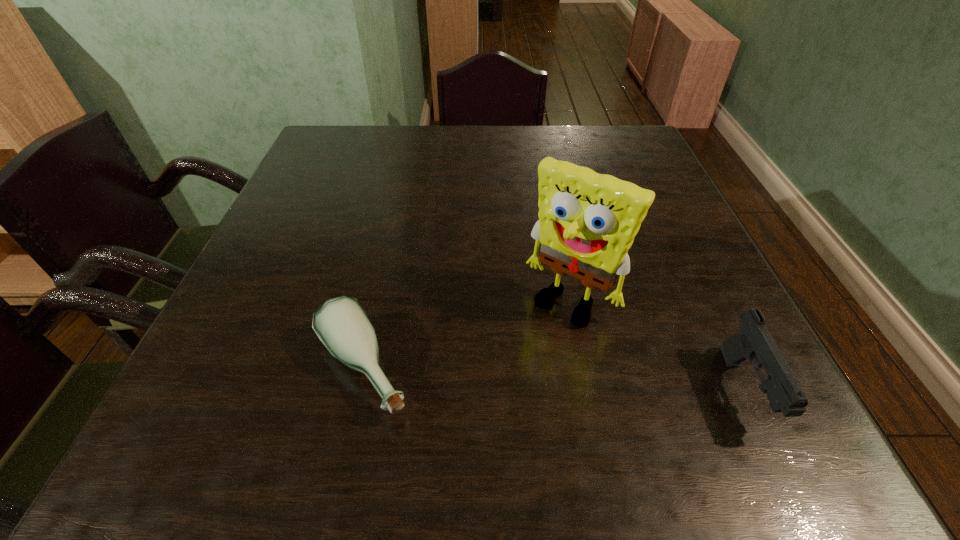
You are a GUI agent. You are given a task and a screenshot of the screen. Output one action in this format:
    pyautogui.click(x=<x>, y=<y>)
    Task: Click on the shortest object
    The width and height of the screenshot is (960, 540).
    Given the screenshot: What is the action you would take?
    pyautogui.click(x=342, y=325)

You are a GUI agent. You are given a task and a screenshot of the screen. Output one action in this format:
    pyautogui.click(x=<x>, y=<y>)
    Task: Click on the leftmost object
    
    Given the screenshot: What is the action you would take?
    pyautogui.click(x=342, y=325)

Image resolution: width=960 pixels, height=540 pixels. What are the coordinates of `the second shortest object` in the screenshot? It's located at (754, 343).

The width and height of the screenshot is (960, 540). I want to click on pistol, so click(x=754, y=343).

Identify the location of the second object from right to left. coord(587,222).

Where is `sponge`? sponge is located at coordinates (587, 222).

Where is `vacant position located on the left of the bottle`? vacant position located on the left of the bottle is located at coordinates (196, 368).

I want to click on vacant region located on the face of the second object from left to right, so click(532, 347).

Find the location of a particular element. The height and width of the screenshot is (540, 960). free spot located on the face of the second object from left to right is located at coordinates (526, 355).

At what (x,y) coordinates should I click in order to perform the action: click on free space located 0.140m on the face of the second object from left to right. Please return your answer as a coordinate pair (x, y). The height and width of the screenshot is (540, 960). Looking at the image, I should click on (507, 380).